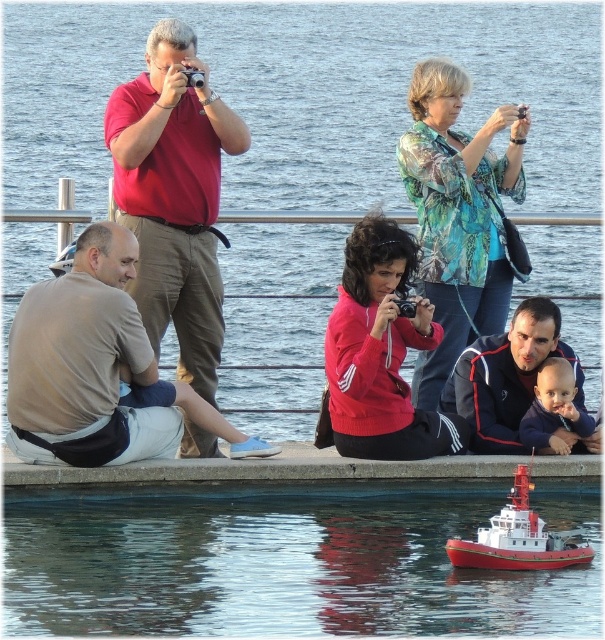
You are a photographer trying to capture a wide shot of the scene. You notice the dark blue track suit at center and the red plastic toy boat at lower right. Which object would require you to zoom in more to focus on its details, and why?

The dark blue track suit at center requires zooming in more because it has a smaller width compared to the red plastic toy boat at lower right, making it appear smaller in the frame.

Consider the image. You are standing at the edge of the waterfront and want to take a photo of the red plastic toy boat at lower right without including the dark blue track suit at center in the frame. Based on their positions, is this possible?

The dark blue track suit at center is to the right of the red plastic toy boat at lower right, so if you position yourself to the left side of the boat, you can frame the shot to exclude the track suit.